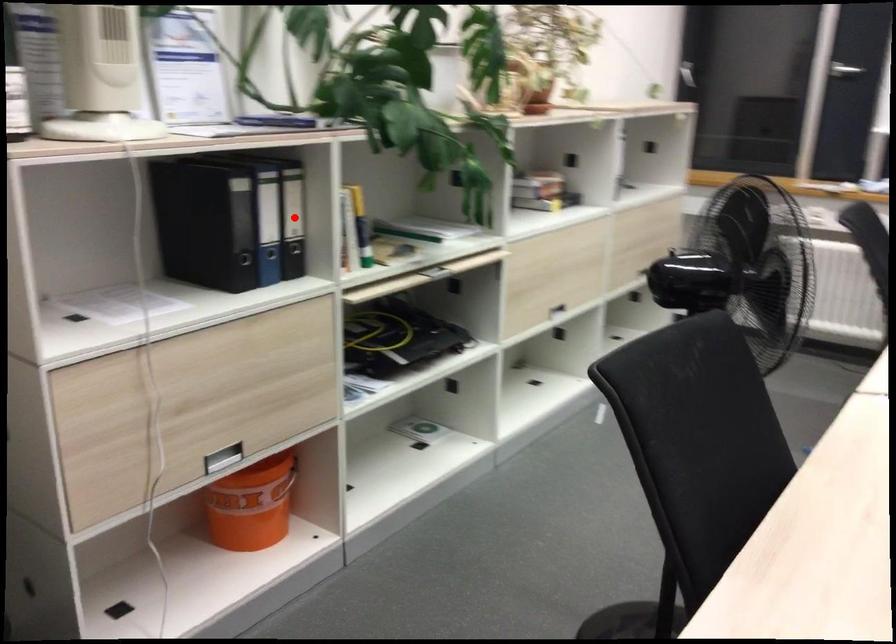
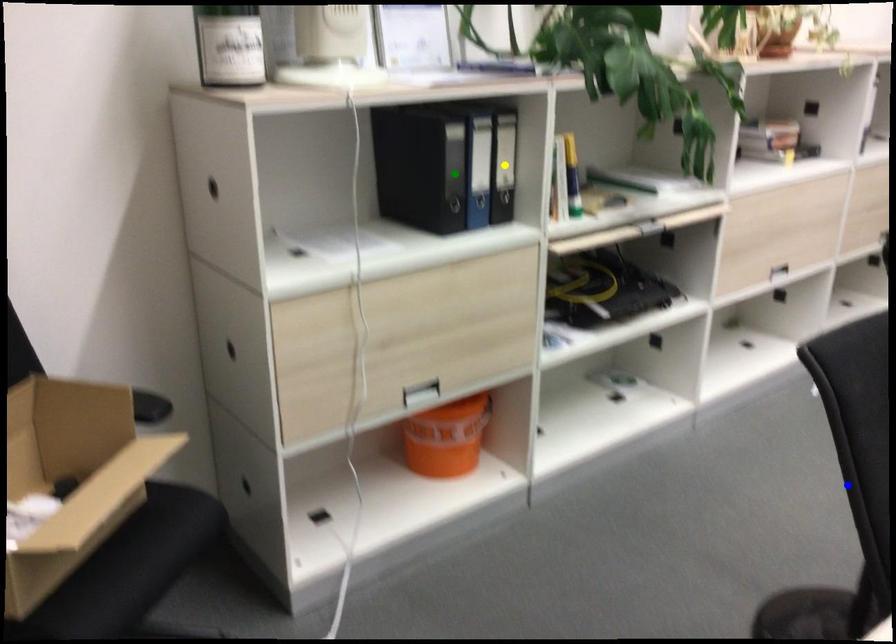
Question: I am providing you with two images of the same scene from different viewpoints. A red point is marked on the first image. You are given multiple points on the second image. Which mark in image 2 goes with the point in image 1?

Choices:
 (A) yellow point
 (B) blue point
 (C) green point

Answer: (A)